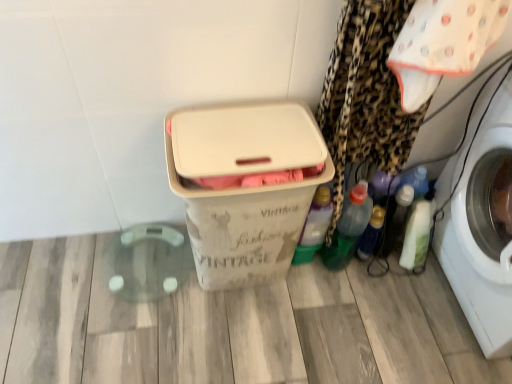
What are the coordinates of `vacant area located to the right-hand side of translucent plastic bottle at lower right, the 3th bottle positioned from the left` in the screenshot? It's located at (421, 283).